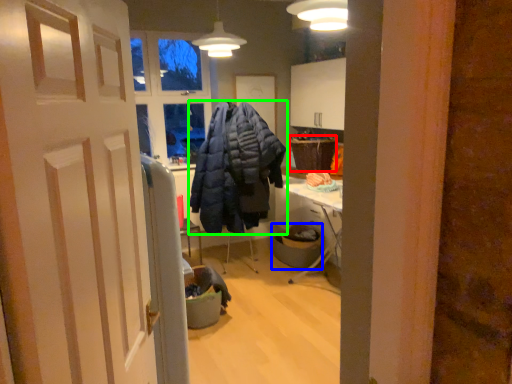
Question: Considering the real-world distances, which object is closest to picnic basket (highlighted by a red box)? trash bin/can (highlighted by a blue box) or jacket (highlighted by a green box).

Choices:
 (A) trash bin/can
 (B) jacket

Answer: (A)